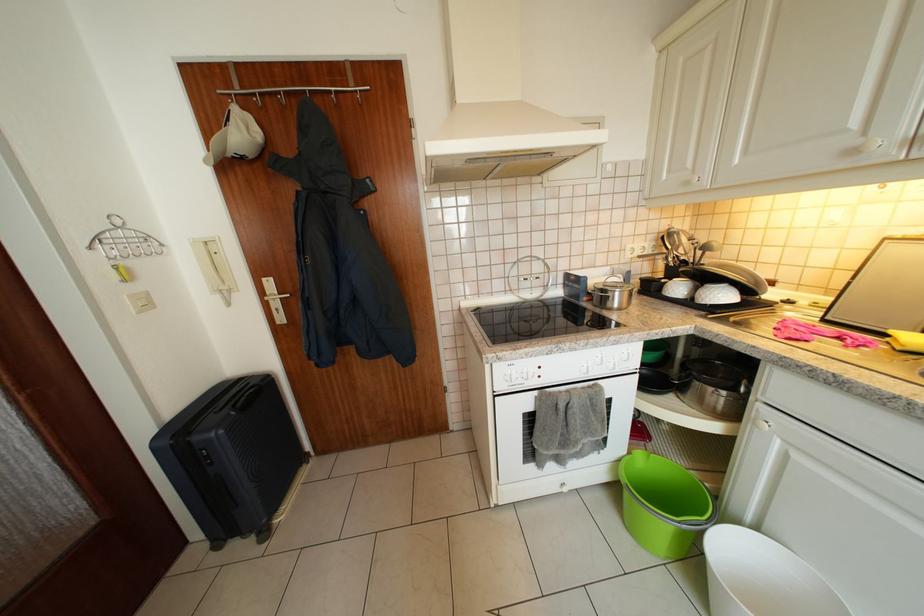
The image size is (924, 616). Describe the element at coordinates (140, 302) in the screenshot. I see `the light switch` at that location.